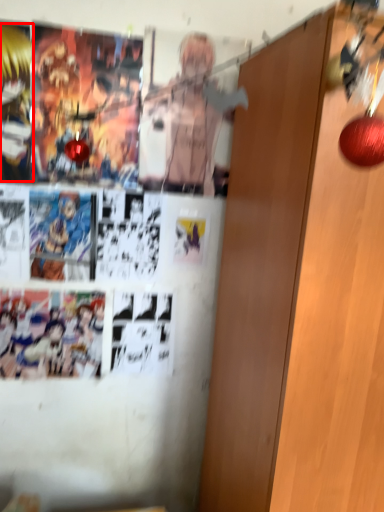
Question: From the image, what is the correct spatial relationship of person (annotated by the red box) in relation to door?

Choices:
 (A) left
 (B) right

Answer: (A)